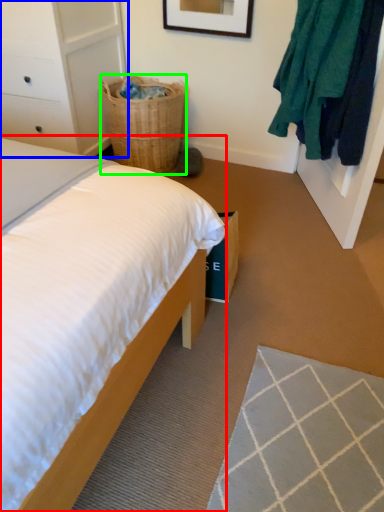
Question: Which object is the closest to the bed (highlighted by a red box)? Choose among these: dresser (highlighted by a blue box) or basket (highlighted by a green box).

Choices:
 (A) dresser
 (B) basket

Answer: (A)